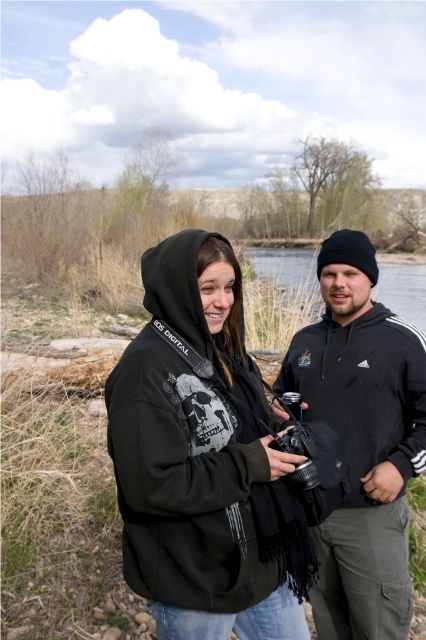
You are a photographer trying to capture both the black matte hoodie at center and the black fleece jacket at right in a single frame. Which clothing item will appear larger in your photo?

The black matte hoodie at center will appear larger in the photo because it is closer to the viewer compared to the black fleece jacket at right.

You are trying to find the black matte hoodie at center in the image. What are the coordinates where you should look?

The coordinates for the black matte hoodie at center are at point [195,500].

You are a photographer trying to capture a photo of the black matte hoodie at center. You notice a point at coordinates point (195,500). Where is this point located in relation to the black matte hoodie at center?

The point (195,500) is located on the black matte hoodie at center.